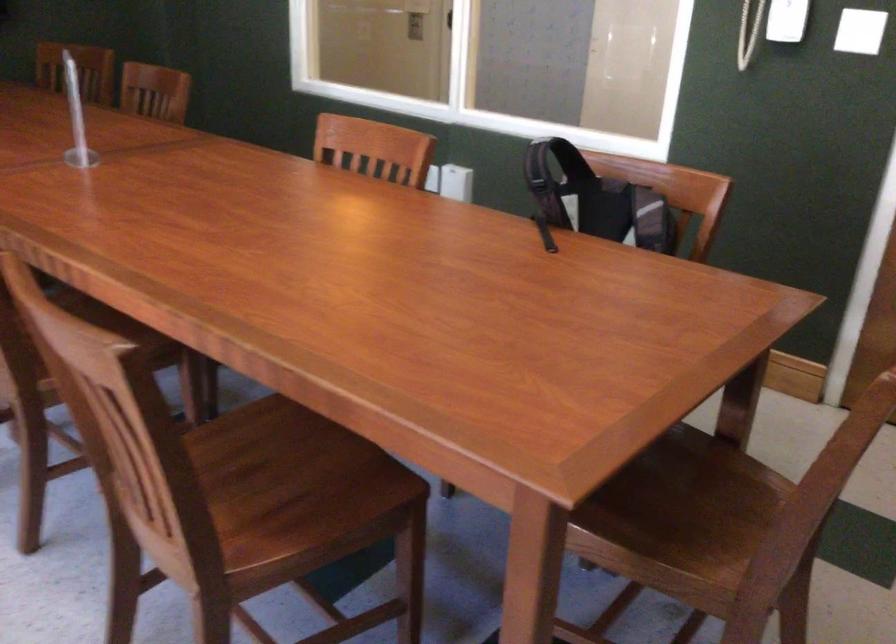
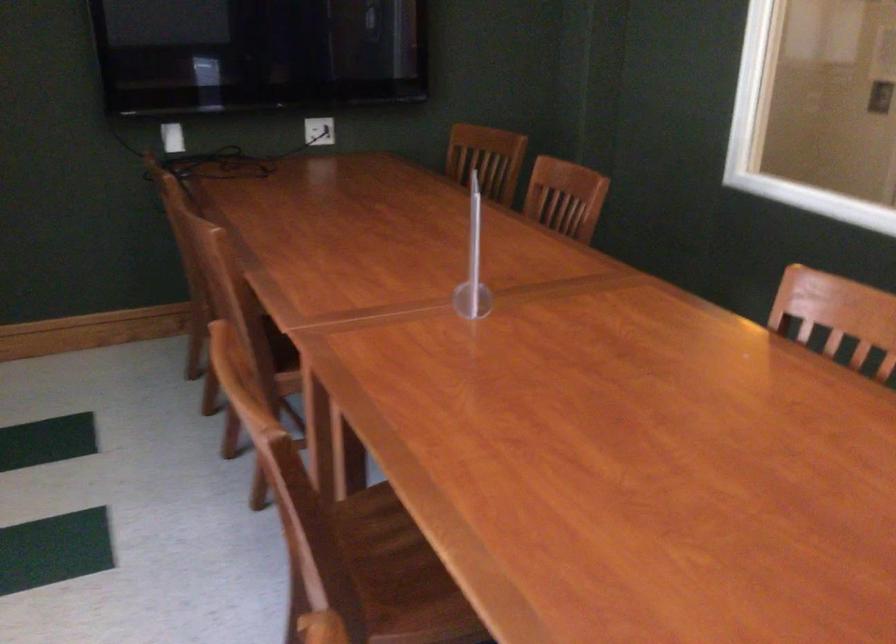
Where in the second image is the point corresponding to [359,140] from the first image?

(841, 313)